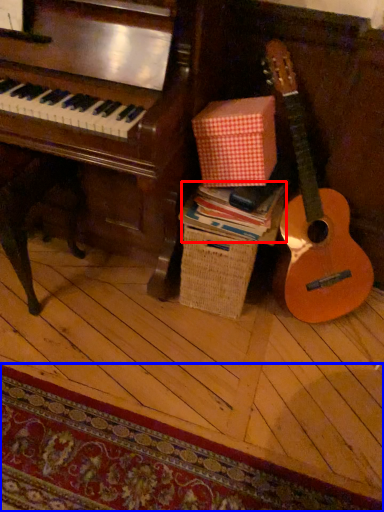
Question: Which object appears farthest to the camera in this image, book (highlighted by a red box) or mat (highlighted by a blue box)?

Choices:
 (A) book
 (B) mat

Answer: (A)